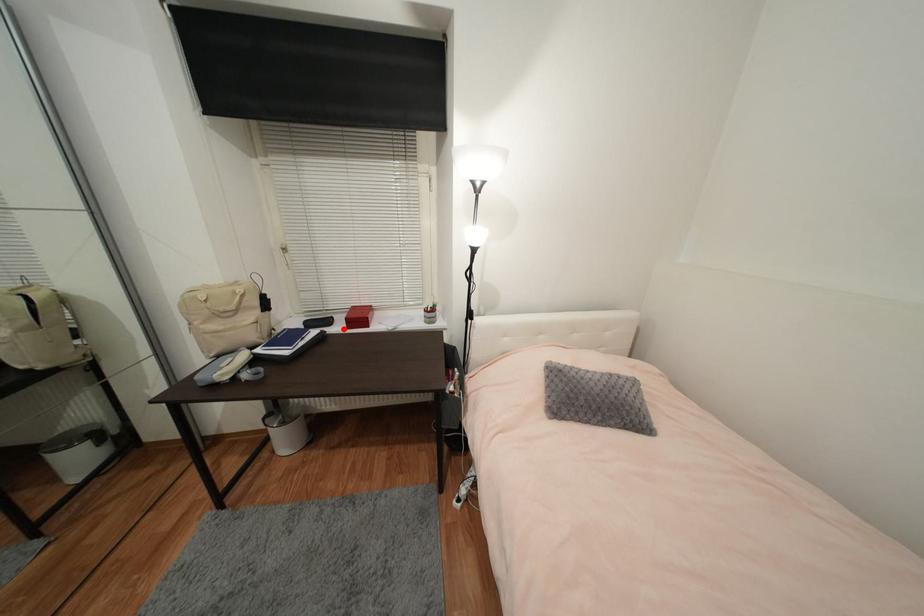
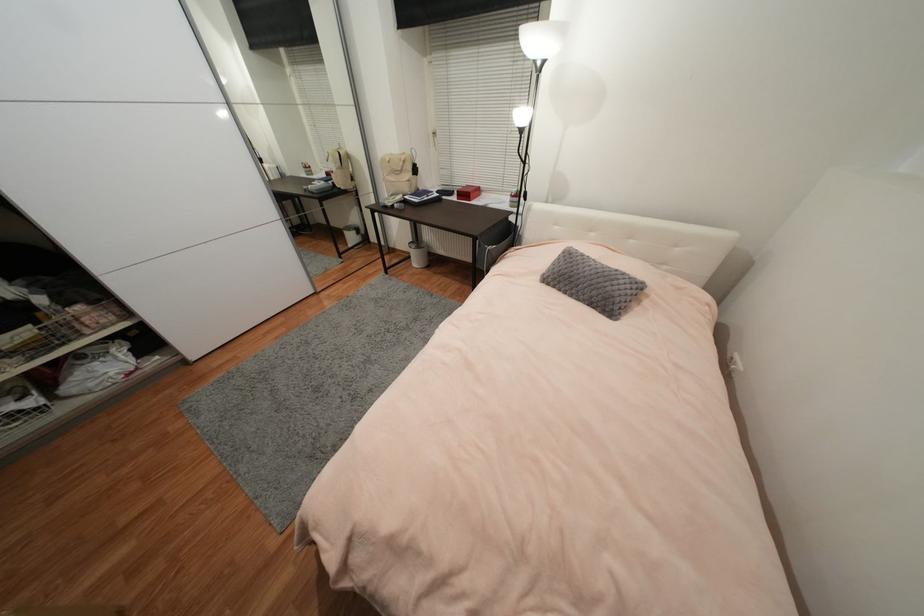
Find the pixel in the second image that matches the highlighted location in the first image.

(458, 199)